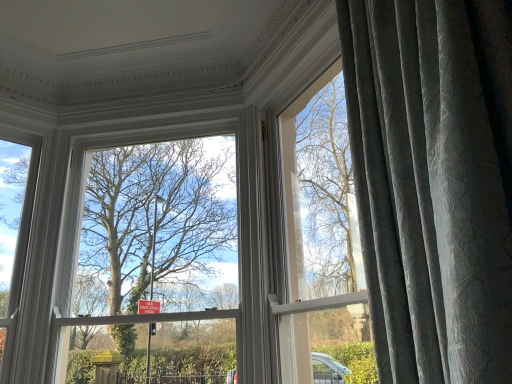
The image size is (512, 384). What do you see at coordinates (433, 183) in the screenshot?
I see `velvet gray curtain at right` at bounding box center [433, 183].

Looking at this image, measure the distance between velvet gray curtain at right and camera.

They are 23.51 inches apart.

Identify the location of velvet gray curtain at right. (433, 183).

This screenshot has width=512, height=384. I want to click on velvet gray curtain at right, so point(433,183).